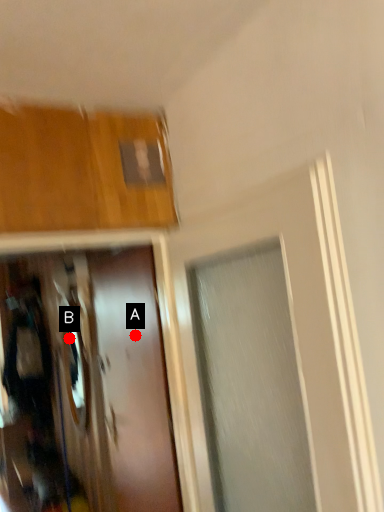
Question: Two points are circled on the image, labeled by A and B beside each circle. Which point is closer to the camera taking this photo?

Choices:
 (A) A is closer
 (B) B is closer

Answer: (A)